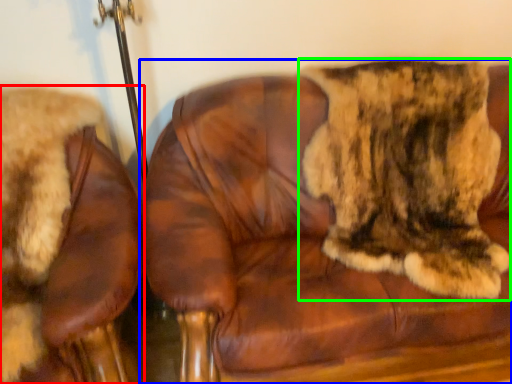
Question: Based on their relative distances, which object is nearer to chair (highlighted by a red box)? Choose from chair (highlighted by a blue box) and cat (highlighted by a green box).

Choices:
 (A) chair
 (B) cat

Answer: (A)